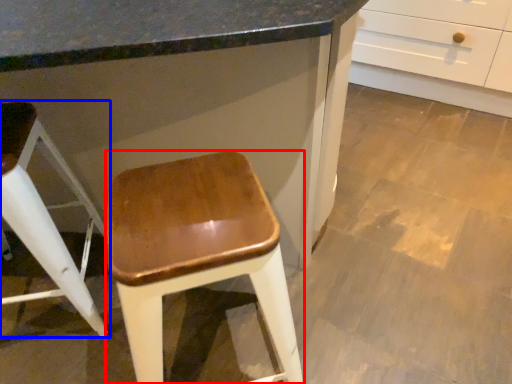
Question: Which object is closer to the camera taking this photo, stool (highlighted by a red box) or stool (highlighted by a blue box)?

Choices:
 (A) stool
 (B) stool

Answer: (A)